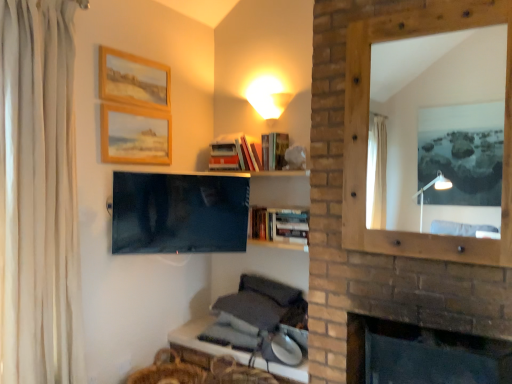
The height and width of the screenshot is (384, 512). What do you see at coordinates (135, 135) in the screenshot?
I see `wooden picture frame at upper left, which is the second picture frame in top-to-bottom order` at bounding box center [135, 135].

The height and width of the screenshot is (384, 512). What do you see at coordinates (274, 150) in the screenshot?
I see `hardcover book at upper center, which is the 3th book in bottom-to-top order` at bounding box center [274, 150].

The height and width of the screenshot is (384, 512). Describe the element at coordinates (203, 342) in the screenshot. I see `wooden table at lower center` at that location.

Consider the image. Measure the distance between point (278, 137) and camera.

A distance of 2.70 meters exists between point (278, 137) and camera.

You are a GUI agent. You are given a task and a screenshot of the screen. Output one action in this format:
    pyautogui.click(x=<x>, y=<y>)
    Task: Click on the wooden picture frame at upper left, the first picture frame in the bottom-to-top sequence
    This screenshot has height=384, width=512.
    Given the screenshot: What is the action you would take?
    pyautogui.click(x=135, y=135)

From the image's perspective, is white fabric curtain at left located above hardcover books at upper center, which is the 4th book from bottom to top?

No, from the image's perspective, white fabric curtain at left is not above hardcover books at upper center, which is the 4th book from bottom to top.

Is point (32, 96) closer to camera compared to point (212, 159)?

Yes.

In order to click on curtain in front of the hardcover books at upper center, which is the 4th book from bottom to top in this screenshot , I will do `click(39, 194)`.

From the picture: Is the position of white fabric curtain at left less distant than that of hardcover books at upper center, which is the 4th book from bottom to top?

Yes, it is.

From a real-world perspective, is matte black tv at center positioned under hardcover books at center, the 1th book from the bottom, based on gravity?

Actually, matte black tv at center is physically above hardcover books at center, the 1th book from the bottom, in the real world.

Is matte black tv at center closer to camera compared to hardcover books at center, which is the fourth book in top-to-bottom order?

Yes, the depth of matte black tv at center is less than that of hardcover books at center, which is the fourth book in top-to-bottom order.

Which book is the 3rd one when counting from the right side of the matte black tv at center? Please provide its 2D coordinates.

[(280, 225)]

From the image's perspective, relative to brown woven basket at lower center, is wooden picture frame at upper left, the first picture frame in the bottom-to-top sequence, above or below?

Based on their image positions, wooden picture frame at upper left, the first picture frame in the bottom-to-top sequence, is located above brown woven basket at lower center.

Considering the relative positions of wooden picture frame at upper left, which is the second picture frame in top-to-bottom order, and brown woven basket at lower center in the image provided, is wooden picture frame at upper left, which is the second picture frame in top-to-bottom order, to the right of brown woven basket at lower center from the viewer's perspective?

No.

Is wooden picture frame at upper left, the first picture frame in the bottom-to-top sequence, positioned behind brown woven basket at lower center?

Yes, wooden picture frame at upper left, the first picture frame in the bottom-to-top sequence, is further from the viewer.

Are wooden picture frame at upper left, the first picture frame in the bottom-to-top sequence, and brown woven basket at lower center making contact?

No, wooden picture frame at upper left, the first picture frame in the bottom-to-top sequence, is not with brown woven basket at lower center.

Is there a large distance between wooden mirror at right and hardcover books at upper center, positioned as the first book in top-to-bottom order?

wooden mirror at right is far away from hardcover books at upper center, positioned as the first book in top-to-bottom order.

How different are the orientations of wooden mirror at right and hardcover books at upper center, which is the 4th book from bottom to top, in degrees?

The angular difference between wooden mirror at right and hardcover books at upper center, which is the 4th book from bottom to top, is 0.548 degrees.

From a real-world perspective, does wooden mirror at right stand above hardcover books at upper center, which is the 4th book from bottom to top?

Indeed, from a real-world perspective, wooden mirror at right stands above hardcover books at upper center, which is the 4th book from bottom to top.

Does wooden mirror at right have a larger size compared to hardcover books at upper center, which is the 4th book from bottom to top?

Correct, wooden mirror at right is larger in size than hardcover books at upper center, which is the 4th book from bottom to top.

Is wooden mirror at right taller or shorter than wooden picture frame at upper left, which appears as the first picture frame when viewed from the top?

In the image, wooden mirror at right appears to be taller than wooden picture frame at upper left, which appears as the first picture frame when viewed from the top.

Between point (467, 7) and point (132, 99), which one is positioned behind?

The point (132, 99) is farther from the camera.

In the scene shown: Would you consider wooden mirror at right to be distant from wooden picture frame at upper left, which appears as the first picture frame when viewed from the top?

wooden mirror at right is far away from wooden picture frame at upper left, which appears as the first picture frame when viewed from the top.

From the image's perspective, would you say wooden mirror at right is shown under wooden picture frame at upper left, the second picture frame in the bottom-to-top sequence?

Indeed, from the image's perspective, wooden mirror at right is shown beneath wooden picture frame at upper left, the second picture frame in the bottom-to-top sequence.

Is wooden table at lower center facing towards hardcover book at upper center, which is the 3th book in bottom-to-top order?

No, wooden table at lower center does not turn towards hardcover book at upper center, which is the 3th book in bottom-to-top order.

From the image's perspective, does wooden table at lower center appear higher than hardcover book at upper center, the second book viewed from the top?

No, from the image's perspective, wooden table at lower center is not over hardcover book at upper center, the second book viewed from the top.

Is wooden table at lower center inside the boundaries of hardcover book at upper center, the second book viewed from the top, or outside?

wooden table at lower center is spatially situated outside hardcover book at upper center, the second book viewed from the top.

Identify the location of book that is the 3rd object located above the wooden table at lower center (from the image's perspective). (274, 150).

Which is in front, hardcover books at center, which is the fourth book in top-to-bottom order, or white fabric curtain at left?

white fabric curtain at left is in front.

In terms of size, does hardcover books at center, the 1th book from the bottom, appear bigger or smaller than white fabric curtain at left?

Considering their sizes, hardcover books at center, the 1th book from the bottom, takes up less space than white fabric curtain at left.

Can you confirm if hardcover books at center, the 1th book from the bottom, is positioned to the right of white fabric curtain at left?

Yes, hardcover books at center, the 1th book from the bottom, is to the right of white fabric curtain at left.

You are a GUI agent. You are given a task and a screenshot of the screen. Output one action in this format:
    pyautogui.click(x=<x>, y=<y>)
    Task: Click on the 3rd book positioned above the white fabric curtain at left (from the image's perspective)
    The height and width of the screenshot is (384, 512).
    Given the screenshot: What is the action you would take?
    pyautogui.click(x=224, y=156)

Where is `television above the hardcover books at center, which is the fourth book in top-to-bottom order (from a real-world perspective)`? Image resolution: width=512 pixels, height=384 pixels. television above the hardcover books at center, which is the fourth book in top-to-bottom order (from a real-world perspective) is located at coordinates click(x=179, y=213).

Which object lies nearer to the anchor point hardcover book at upper center, which is the 3th book in bottom-to-top order, hardcover books at center, which is the fourth book in top-to-bottom order, or matte black tv at center?

Among the two, hardcover books at center, which is the fourth book in top-to-bottom order, is located nearer to hardcover book at upper center, which is the 3th book in bottom-to-top order.

Based on their spatial positions, is wooden picture frame at upper left, which is the second picture frame in top-to-bottom order, or brown woven basket at lower center closer to wooden mirror at right?

wooden picture frame at upper left, which is the second picture frame in top-to-bottom order, lies closer to wooden mirror at right than the other object.

Considering their positions, is dark brick fireplace at lower right positioned closer to matte black tv at center than hardcover book at upper center, which is the 3th book in bottom-to-top order?

hardcover book at upper center, which is the 3th book in bottom-to-top order.

Based on their spatial positions, is wooden table at lower center or matte black tv at center further from hardcover books at upper center, which is the 4th book from bottom to top?

Among the two, wooden table at lower center is located further to hardcover books at upper center, which is the 4th book from bottom to top.

Considering their positions, is wooden table at lower center positioned closer to matte black tv at center than wooden picture frame at upper left, the second picture frame in the bottom-to-top sequence?

Based on the image, wooden picture frame at upper left, the second picture frame in the bottom-to-top sequence, appears to be nearer to matte black tv at center.

When comparing their distances from wooden mirror at right, does matte black tv at center or hardcover books at upper center, marked as the third book in a top-to-bottom arrangement, seem further?

Among the two, matte black tv at center is located further to wooden mirror at right.

Considering their positions, is wooden picture frame at upper left, which is the second picture frame in top-to-bottom order, positioned closer to wooden mirror at right than dark brick fireplace at lower right?

dark brick fireplace at lower right is positioned closer to the anchor wooden mirror at right.

When comparing their distances from dark brick fireplace at lower right, does hardcover book at upper center, which is the 3th book in bottom-to-top order, or wooden picture frame at upper left, which appears as the first picture frame when viewed from the top, seem closer?

Based on the image, hardcover book at upper center, which is the 3th book in bottom-to-top order, appears to be nearer to dark brick fireplace at lower right.

You are a GUI agent. You are given a task and a screenshot of the screen. Output one action in this format:
    pyautogui.click(x=<x>, y=<y>)
    Task: Click on the picture frame between white fabric curtain at left and matte black tv at center along the z-axis
    This screenshot has height=384, width=512.
    Given the screenshot: What is the action you would take?
    pyautogui.click(x=133, y=80)

Locate an element on the screen. picture frame between matte black tv at center and hardcover books at upper center, positioned as the first book in top-to-bottom order, from front to back is located at coordinates (135, 135).

Where is `light fixture between wooden picture frame at upper left, the first picture frame in the bottom-to-top sequence, and wooden mirror at right, in the horizontal direction`? This screenshot has height=384, width=512. light fixture between wooden picture frame at upper left, the first picture frame in the bottom-to-top sequence, and wooden mirror at right, in the horizontal direction is located at coordinates (268, 97).

At what (x,y) coordinates should I click in order to perform the action: click on picture frame between wooden picture frame at upper left, the second picture frame in the bottom-to-top sequence, and wooden mirror at right from left to right. Please return your answer as a coordinate pair (x, y). Looking at the image, I should click on (135, 135).